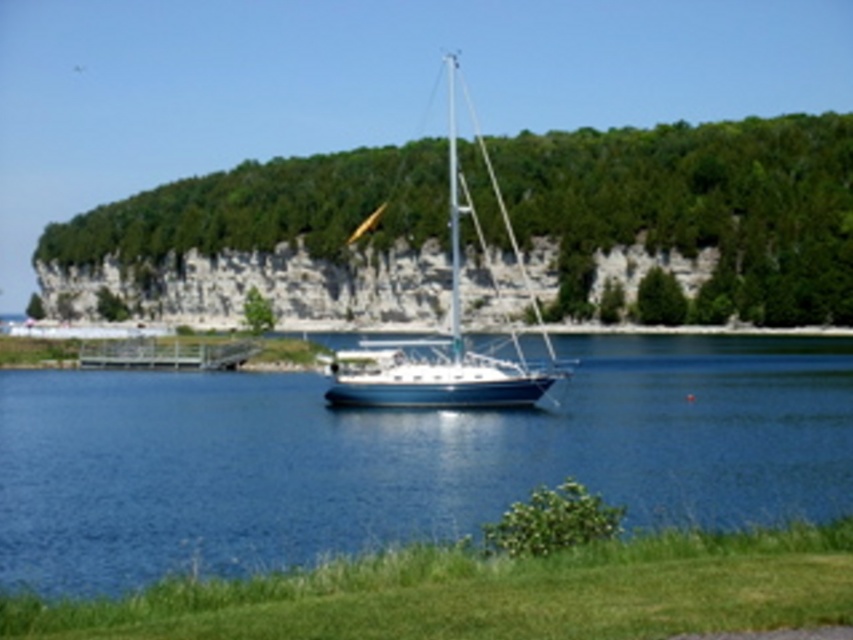
You are standing at the lakeside and want to reach the point marked at coordinates (752, 458). Given that you can walk 100 feet before needing to rest, will you need to rest before reaching the point?

The distance between you and the point marked at coordinates (752, 458) is 131.19 feet. Since you can walk 100 feet before needing to rest, you will need to rest before reaching the point.

You are standing at the edge of the lake and see the point marked at coordinates (403, 458). What is located at that point?

The point at coordinates (403, 458) indicates blue glossy water at center.

You are standing at the point with coordinates [403,458] in the scene. What do you see directly in front of you?

You see blue glossy water at center directly in front of you at point [403,458].